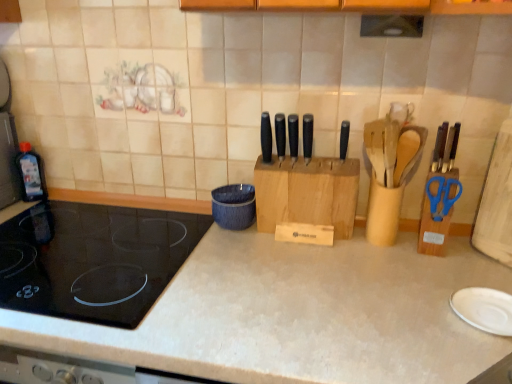
The width and height of the screenshot is (512, 384). Identify the location of empty space that is ontop of wooden knife block at center (from a real-world perspective). pyautogui.click(x=313, y=158).